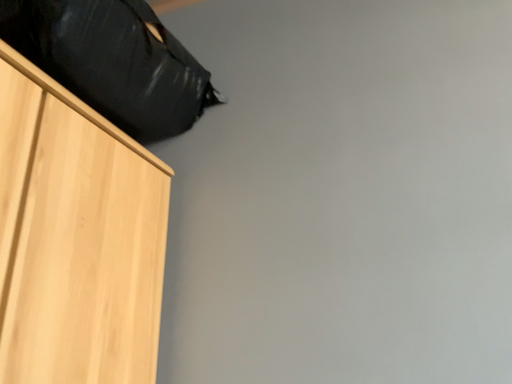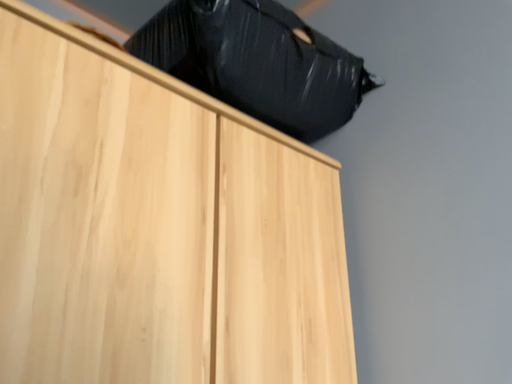
Question: How did the camera likely rotate when shooting the video?

Choices:
 (A) rotated right
 (B) rotated left

Answer: (B)